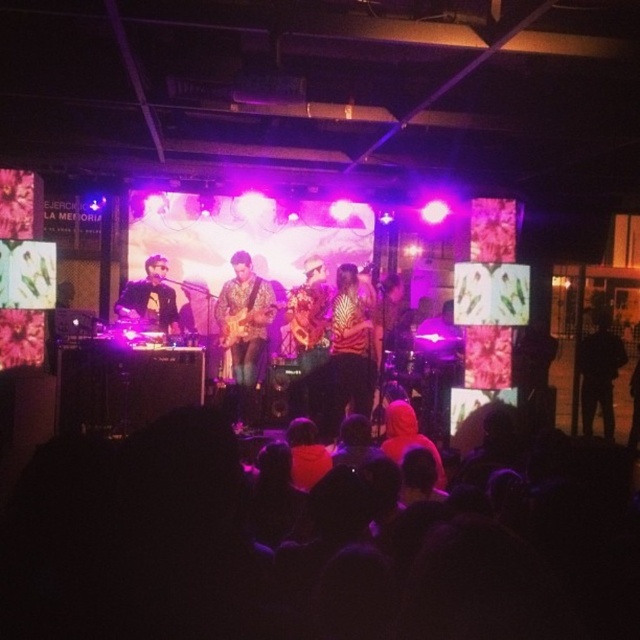
Question: Which of these objects is positioned closest to the matte black keyboard at left?

Choices:
 (A) floral fabric guitar at center
 (B) zebra-patterned shirt at center

Answer: (A)

Question: Which point is farther from the camera taking this photo?

Choices:
 (A) (352, 324)
 (B) (164, 284)
 (C) (260, 346)

Answer: (B)

Question: Is black fabric at lower center smaller than floral fabric guitar at center?

Choices:
 (A) yes
 (B) no

Answer: (B)

Question: Which object is positioned farthest from the black fabric at lower center?

Choices:
 (A) floral fabric guitar at center
 (B) zebra-patterned shirt at center

Answer: (A)

Question: Does floral fabric guitar at center appear on the left side of matte black keyboard at left?

Choices:
 (A) no
 (B) yes

Answer: (A)

Question: Can you confirm if zebra-patterned shirt at center is positioned below floral fabric guitar at center?

Choices:
 (A) no
 (B) yes

Answer: (B)